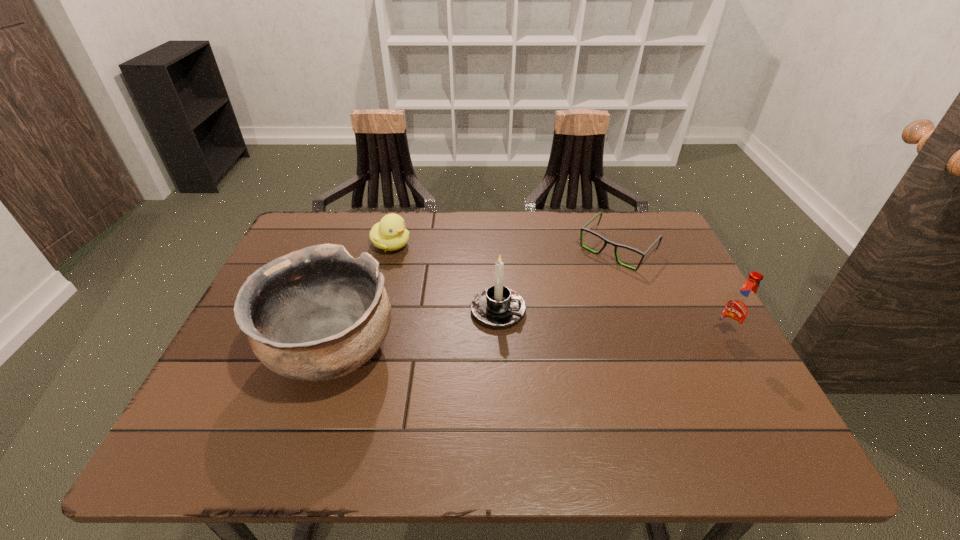
Identify the location of vacant space located with a handle on the side of the candle holder. The image size is (960, 540). (644, 363).

Image resolution: width=960 pixels, height=540 pixels. What are the coordinates of `vacant space located on the lens of the spectacles` in the screenshot? It's located at (515, 352).

This screenshot has width=960, height=540. I want to click on free space located 0.310m on the lens of the spectacles, so click(535, 332).

Find the location of a particular element. free space located on the lens of the spectacles is located at coordinates (537, 329).

This screenshot has height=540, width=960. Find the location of `vacant space located at the beak of the second shortest object`. vacant space located at the beak of the second shortest object is located at coordinates (x=458, y=284).

Identify the location of vacant region located 0.220m at the beak of the second shortest object. The height and width of the screenshot is (540, 960). (461, 286).

The width and height of the screenshot is (960, 540). I want to click on vacant position located 0.050m at the beak of the second shortest object, so click(x=416, y=260).

Find the location of a particular element. Image resolution: width=960 pixels, height=540 pixels. spectacles present at the far edge is located at coordinates (583, 228).

Locate an element on the screen. The image size is (960, 540). duckling at the far edge is located at coordinates (390, 234).

At what (x,y) coordinates should I click in order to perform the action: click on object at the near edge. Please return your answer as a coordinate pair (x, y). Looking at the image, I should click on (316, 314).